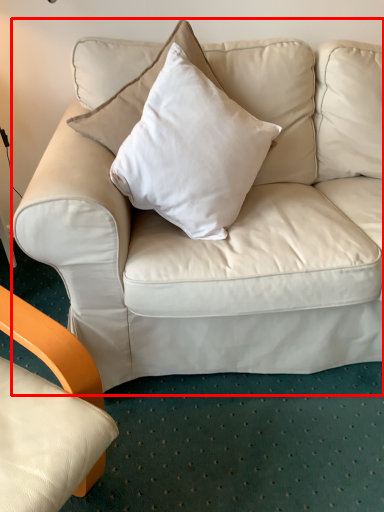
Question: From the image's perspective, considering the relative positions of studio couch (annotated by the red box) and pillow in the image provided, where is studio couch (annotated by the red box) located with respect to the staircase?

Choices:
 (A) above
 (B) below

Answer: (A)